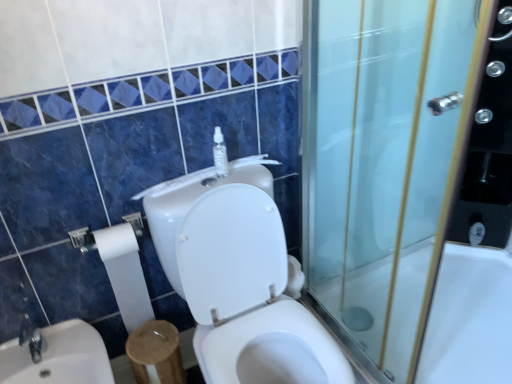
This screenshot has width=512, height=384. I want to click on vacant space situated on the left part of clear plastic bottle at upper center, so click(180, 187).